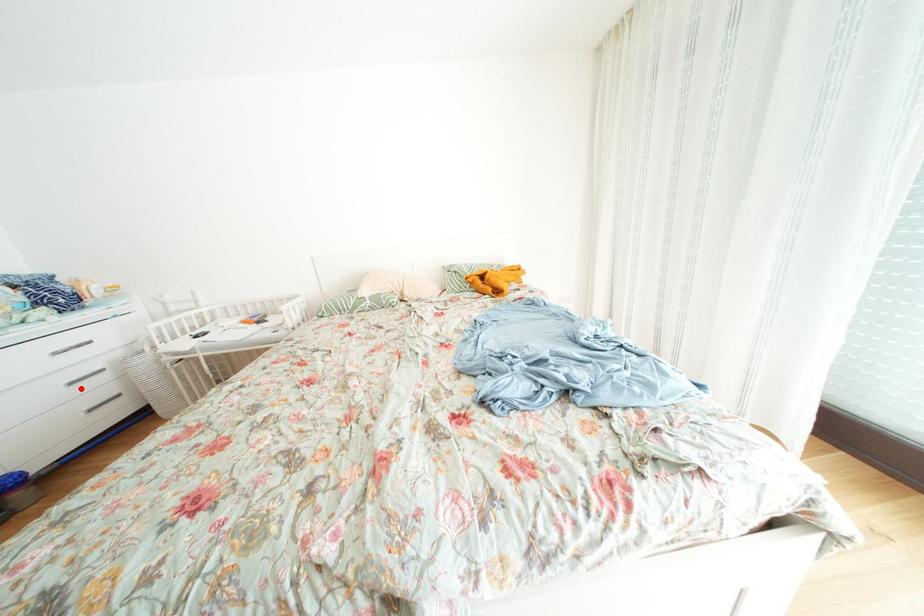
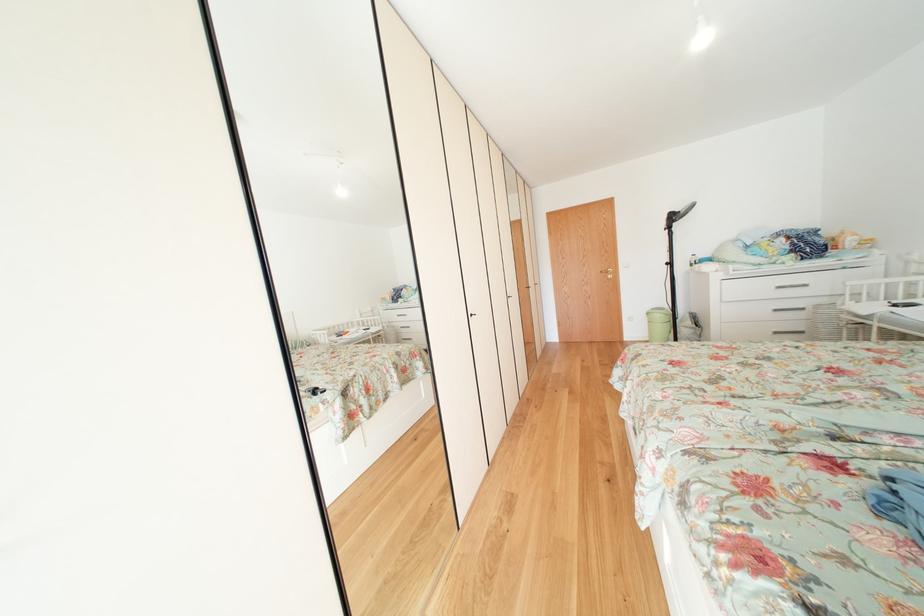
Question: A red point is marked in image1. In image2, is the corresponding 3D point closer to the camera or farther? Reply with the corresponding letter.

Choices:
 (A) The corresponding 3D point is closer.
 (B) The corresponding 3D point is farther.

Answer: (B)